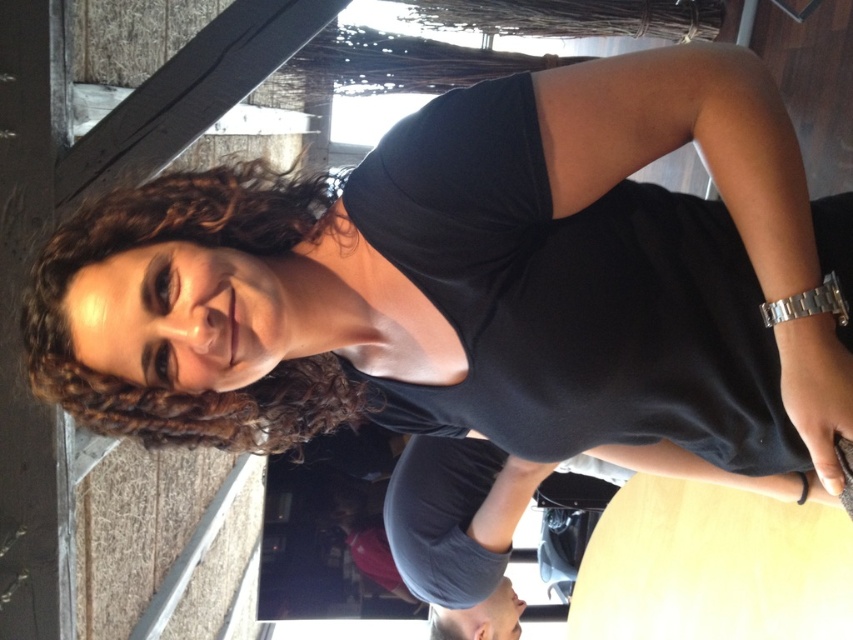
Who is positioned more to the right, black matte dress at center or curly brown hair at upper left?

black matte dress at center

Is point (469, 426) positioned before point (166, 186)?

No, (469, 426) is behind (166, 186).

At what (x,y) coordinates should I click in order to perform the action: click on black matte dress at center. Please return your answer as a coordinate pair (x, y). This screenshot has height=640, width=853. Looking at the image, I should click on (573, 282).